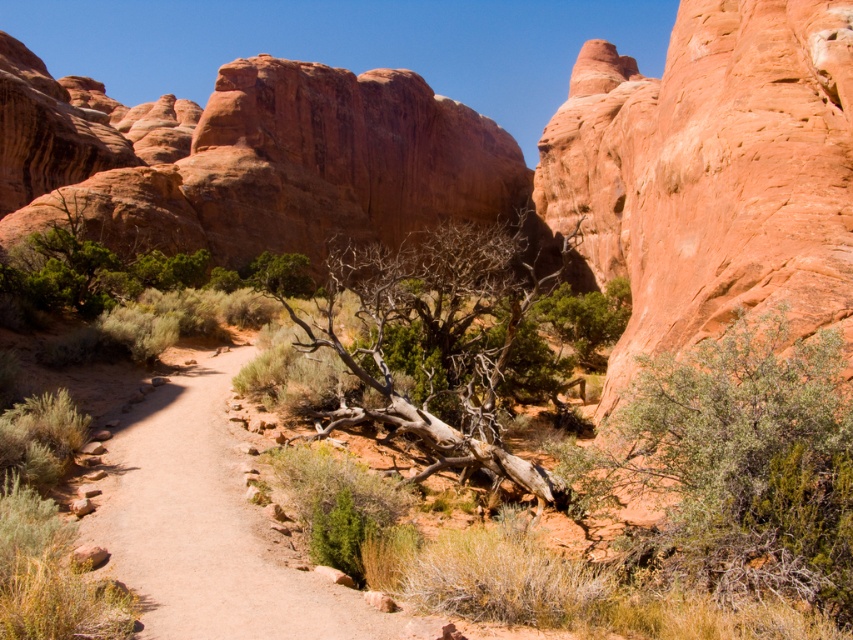
Question: Does green leafy shrub at right appear under dead wood at center?

Choices:
 (A) yes
 (B) no

Answer: (A)

Question: Which object appears closest to the camera in this image?

Choices:
 (A) green leafy shrub at right
 (B) brown dirt path at center
 (C) dead wood at center

Answer: (A)

Question: Which of the following is the farthest from the observer?

Choices:
 (A) brown dirt path at center
 (B) green leafy shrub at right

Answer: (A)

Question: Is green leafy shrub at right smaller than dead wood at center?

Choices:
 (A) no
 (B) yes

Answer: (B)

Question: Is green leafy shrub at right behind brown dirt path at center?

Choices:
 (A) no
 (B) yes

Answer: (A)

Question: Which of the following is the closest to the observer?

Choices:
 (A) green leafy shrub at right
 (B) dead wood at center
 (C) brown dirt path at center

Answer: (A)